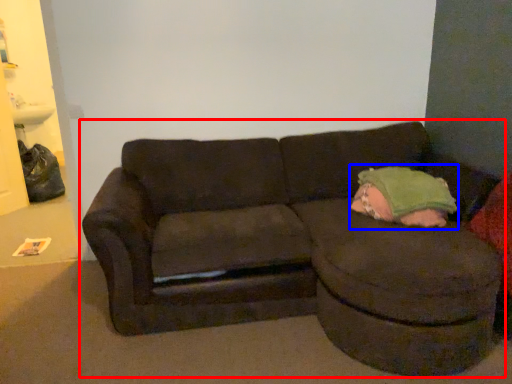
Question: Which of the following is the farthest to the observer, studio couch (highlighted by a red box) or toddler (highlighted by a blue box)?

Choices:
 (A) studio couch
 (B) toddler

Answer: (B)